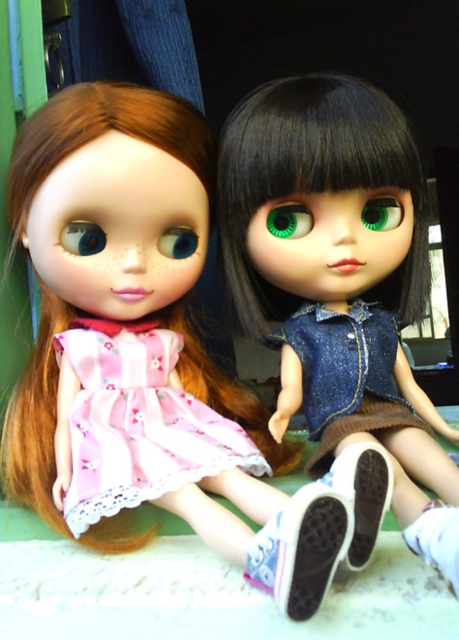
You are an interior designer arranging a dollhouse scene. You need to place a new decorative item exactly where the pink fabric dress at center is currently located. According to the coordinates provided, what are the coordinates where you should place the new item?

The pink fabric dress at center is located at point (145, 333), so you should place the new decorative item at those coordinates.

You are a child who is 1.2 meters tall. You see the denim jacket at center in the image. Can you reach it if you stand on your tiptoes?

The denim jacket at center is 46.14 centimeters away from the viewer. Since the child is 1.2 meters tall, which is 120 centimeters, standing on tiptoes might add an extra 5 centimeters, making the total reach approximately 125 centimeters. The jacket is only 46.14 centimeters away, so yes, the child can easily reach it.